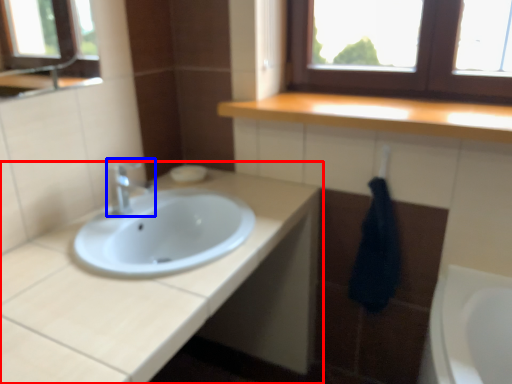
Question: Which of the following is the farthest to the observer, bathroom cabinet (highlighted by a red box) or tap (highlighted by a blue box)?

Choices:
 (A) bathroom cabinet
 (B) tap

Answer: (B)